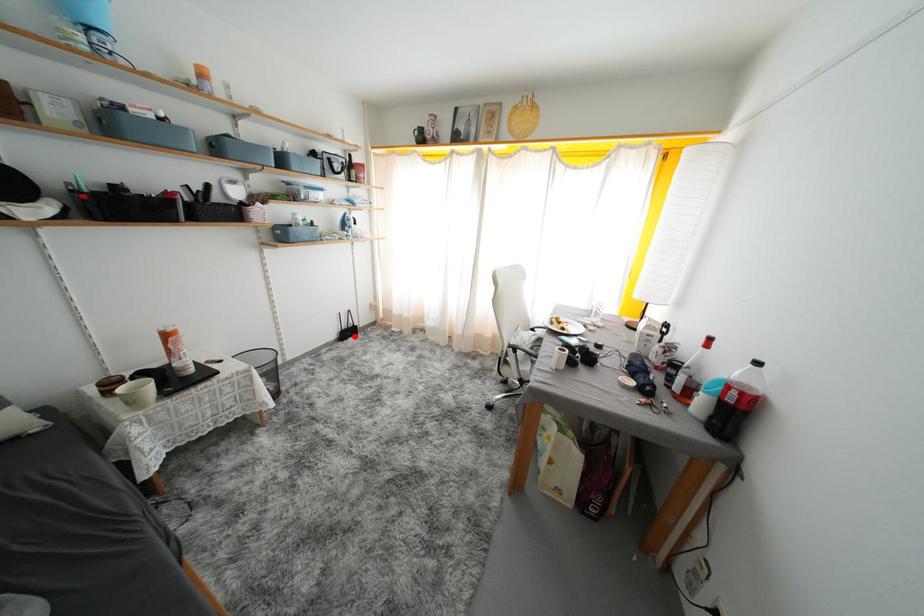
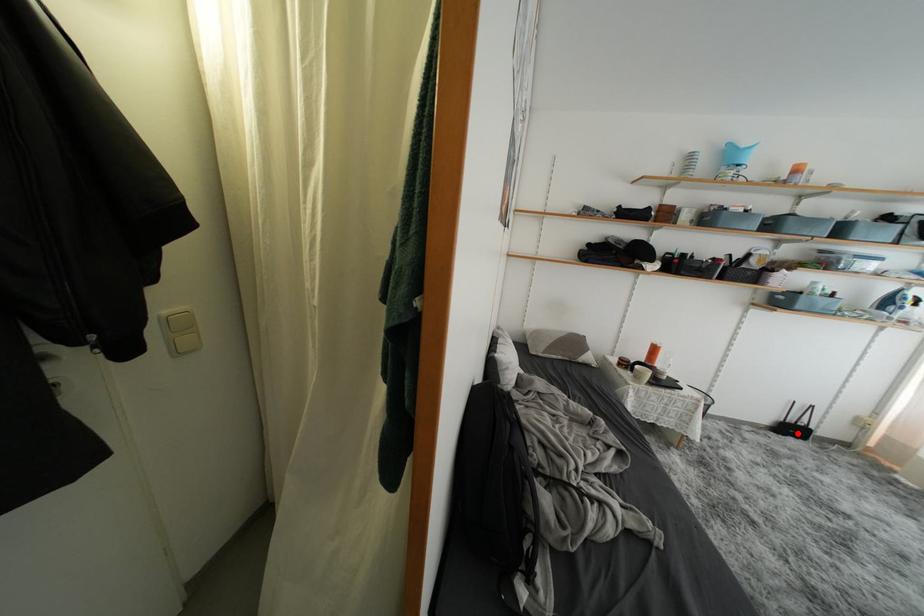
I am providing you with two images of the same scene from different viewpoints. A red point is marked on the first image and another point is marked on the second image. Are the points marked in image1 and image2 representing the same 3D position?

Yes